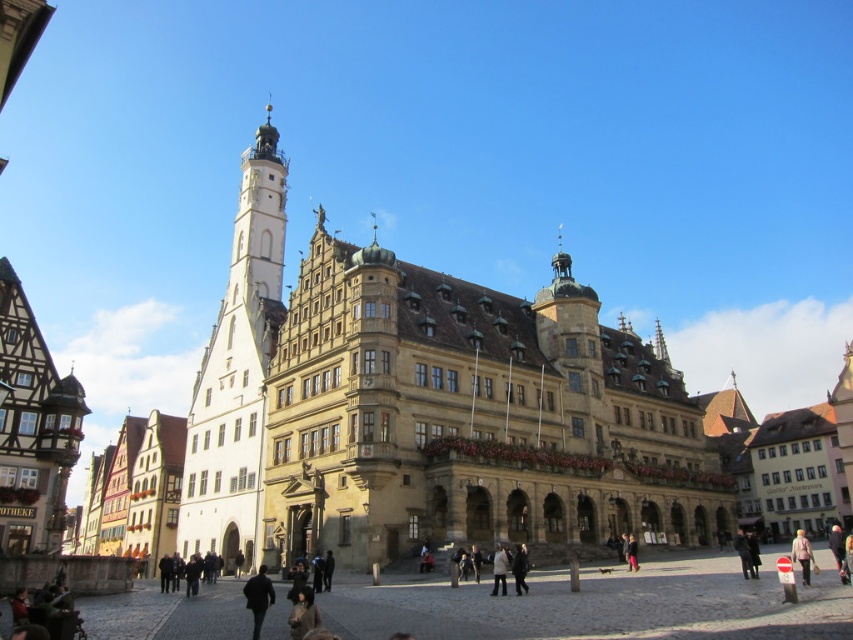
Question: Does light beige fabric coat at lower right come in front of light beige jacket at center?

Choices:
 (A) yes
 (B) no

Answer: (A)

Question: Observing the image, what is the correct spatial positioning of white stone tower at center-left in reference to black matte jacket at center?

Choices:
 (A) right
 (B) left

Answer: (B)

Question: Which point appears farthest from the camera in this image?

Choices:
 (A) (495, 547)
 (B) (802, 566)
 (C) (251, 589)

Answer: (A)

Question: Estimate the real-world distances between objects in this image. Which object is farther from the light beige fabric coat at lower right?

Choices:
 (A) light beige jacket at center
 (B) black matte jacket at center
 (C) white stone tower at center-left

Answer: (C)

Question: Where is black matte jacket at center located in relation to light beige fabric coat at lower right in the image?

Choices:
 (A) below
 (B) above

Answer: (B)

Question: Which of the following is the farthest from the observer?

Choices:
 (A) light beige fabric coat at lower right
 (B) black matte jacket at center

Answer: (A)